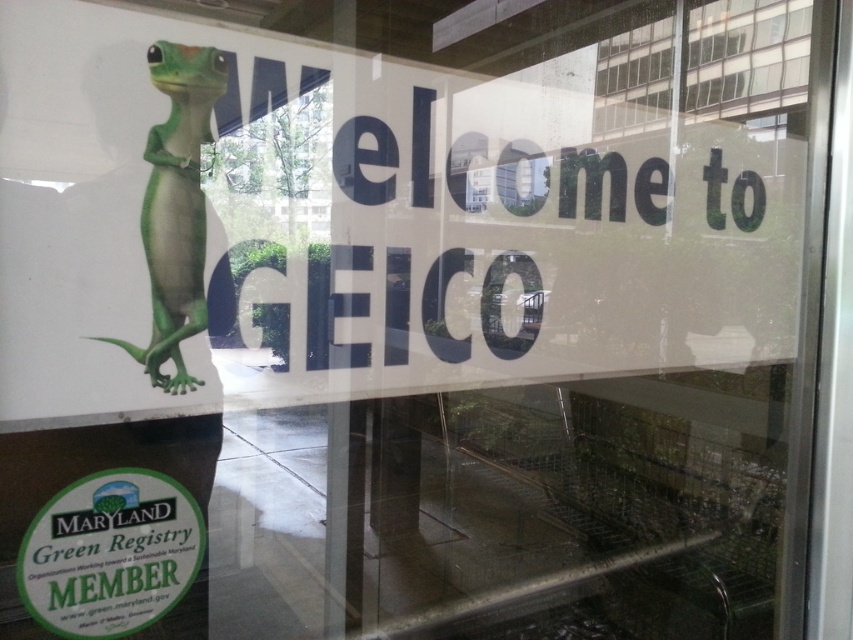
Question: Can you confirm if transparent glass window at upper center is smaller than green matte lizard at upper left?

Choices:
 (A) yes
 (B) no

Answer: (B)

Question: Which object appears farthest from the camera in this image?

Choices:
 (A) green matte lizard at upper left
 (B) transparent glass window at upper center

Answer: (B)

Question: Can you confirm if transparent glass window at upper center is positioned above green matte lizard at upper left?

Choices:
 (A) yes
 (B) no

Answer: (A)

Question: Does transparent glass window at upper center have a larger size compared to green matte lizard at upper left?

Choices:
 (A) no
 (B) yes

Answer: (B)

Question: Which of the following is the farthest from the observer?

Choices:
 (A) green matte lizard at upper left
 (B) transparent glass window at upper center

Answer: (B)